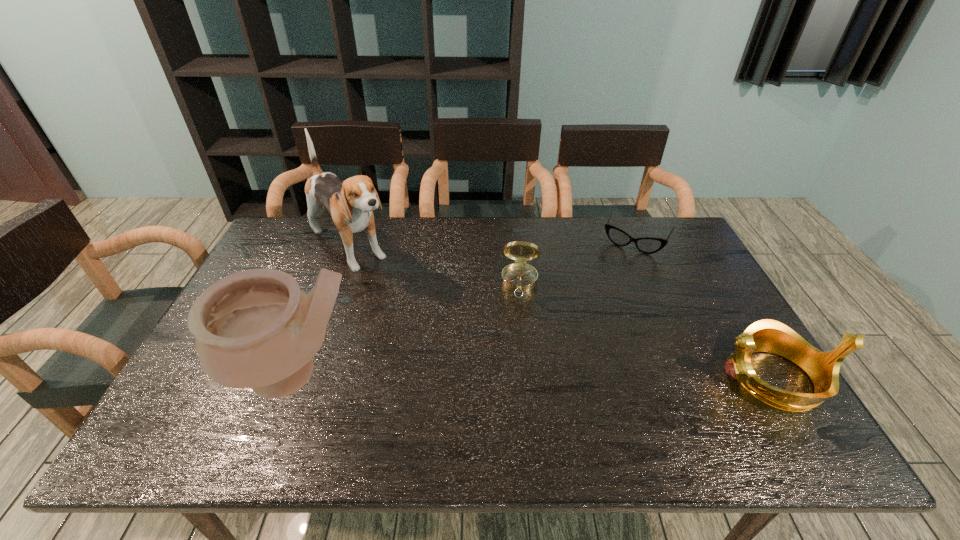
I want to click on free space at the far edge, so click(x=329, y=250).

In the image, there is a desktop. Where is `vacant space at the near edge`? The height and width of the screenshot is (540, 960). vacant space at the near edge is located at coordinates (656, 385).

This screenshot has width=960, height=540. Find the location of `vacant space at the right edge`. vacant space at the right edge is located at coordinates (677, 262).

Where is `free spot at the far left corner of the desktop`? Image resolution: width=960 pixels, height=540 pixels. free spot at the far left corner of the desktop is located at coordinates 306,259.

Identify the location of free spot at the far right corner of the desktop. The height and width of the screenshot is (540, 960). (674, 247).

In the image, there is a desktop. Identify the location of free space at the near right corner. (750, 399).

What are the coordinates of `empty space between the shortest object and the puppy` in the screenshot? It's located at [492, 244].

At what (x,y) coordinates should I click in order to perform the action: click on free space between the tiara and the puppy. Please return your answer as a coordinate pair (x, y). This screenshot has width=960, height=540. Looking at the image, I should click on (562, 313).

Find the location of a particular element. The width and height of the screenshot is (960, 540). vacant region between the puppy and the tiara is located at coordinates (562, 313).

Locate an element on the screen. This screenshot has width=960, height=540. vacant area that lies between the compass and the spectacles is located at coordinates (578, 262).